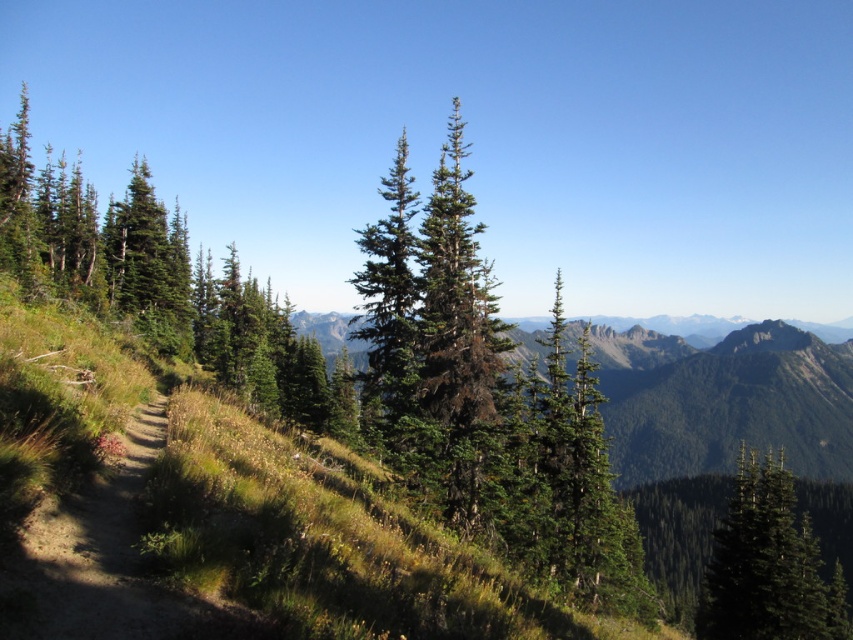
Which of these two, green needle-like tree at center-left or green matte evergreen tree at center, stands taller?

green needle-like tree at center-left

Is green needle-like tree at center-left below green matte evergreen tree at center?

No.

Where is `green needle-like tree at center-left`? The image size is (853, 640). green needle-like tree at center-left is located at coordinates (161, 284).

Identify the location of green needle-like tree at center-left. (161, 284).

Can you confirm if green needle-like tree at center-left is shorter than green textured tree at center?

No.

Between green needle-like tree at center-left and green textured tree at center, which one is positioned lower?

green needle-like tree at center-left is below.

Which is in front, point (351, 444) or point (445, 275)?

Positioned in front is point (445, 275).

You are a GUI agent. You are given a task and a screenshot of the screen. Output one action in this format:
    pyautogui.click(x=<x>, y=<y>)
    Task: Click on the green needle-like tree at center-left
    
    Given the screenshot: What is the action you would take?
    pyautogui.click(x=161, y=284)

Between green matte tree at right and green matte evergreen tree at center, which one is positioned lower?

green matte tree at right

Which is behind, point (750, 499) or point (393, 268)?

The point (750, 499) is more distant.

Describe the element at coordinates (769, 564) in the screenshot. I see `green matte tree at right` at that location.

At what (x,y) coordinates should I click in order to perform the action: click on green matte tree at right. Please return your answer as a coordinate pair (x, y). Image resolution: width=853 pixels, height=640 pixels. Looking at the image, I should click on (769, 564).